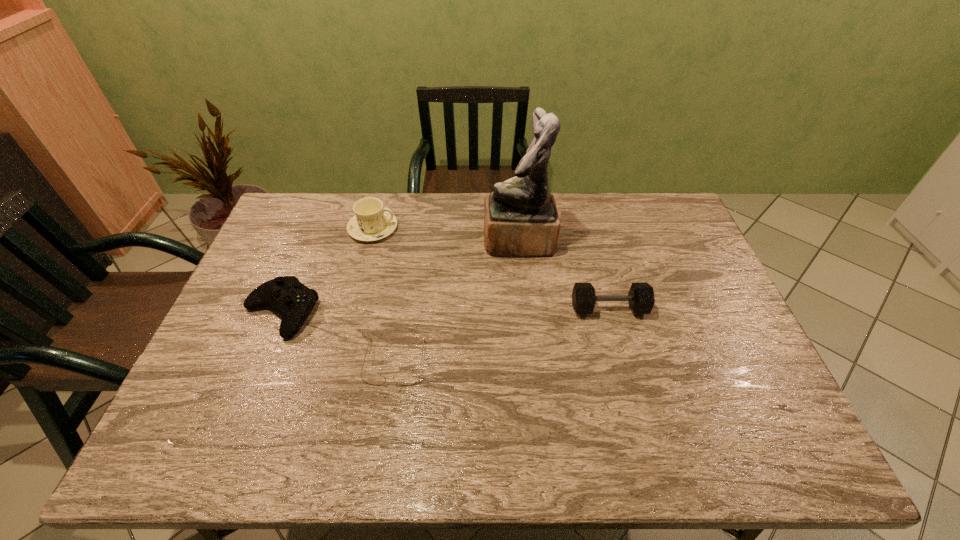
I want to click on vacant area between the fourth tallest object and the shortest object, so click(x=338, y=337).

This screenshot has height=540, width=960. I want to click on free space between the chinaware and the rightmost object, so click(491, 268).

Where is `vacant space in between the shortest object and the second shortest object`? This screenshot has height=540, width=960. vacant space in between the shortest object and the second shortest object is located at coordinates (338, 337).

Identify the location of free area in between the chinaware and the tallest object. (445, 235).

I want to click on object that is the fourth closest one to the chinaware, so click(641, 299).

At what (x,y) coordinates should I click in order to perform the action: click on object identified as the closest to the tallest object. Please return your answer as a coordinate pair (x, y). This screenshot has width=960, height=540. Looking at the image, I should click on [x=641, y=299].

At what (x,y) coordinates should I click in order to perform the action: click on free space that satisfies the following two spatial constraints: 1. on the handle side of the dumbbell; 2. on the left side of the chinaware. Please return your answer as a coordinate pair (x, y). Looking at the image, I should click on (352, 308).

Where is `vacant space that satisfies the following two spatial constraints: 1. in a relaxed pose on the sculpture; 2. on the front-facing side of the shortest object`? vacant space that satisfies the following two spatial constraints: 1. in a relaxed pose on the sculpture; 2. on the front-facing side of the shortest object is located at coordinates (530, 362).

This screenshot has width=960, height=540. Identify the location of blank space that satisfies the following two spatial constraints: 1. in a relaxed pose on the dumbbell; 2. on the right side of the tallest object. (525, 308).

Where is `free space that satisfies the following two spatial constraints: 1. on the back side of the rightmost object; 2. in a relaxed pose on the tallest object`? The width and height of the screenshot is (960, 540). free space that satisfies the following two spatial constraints: 1. on the back side of the rightmost object; 2. in a relaxed pose on the tallest object is located at coordinates (591, 241).